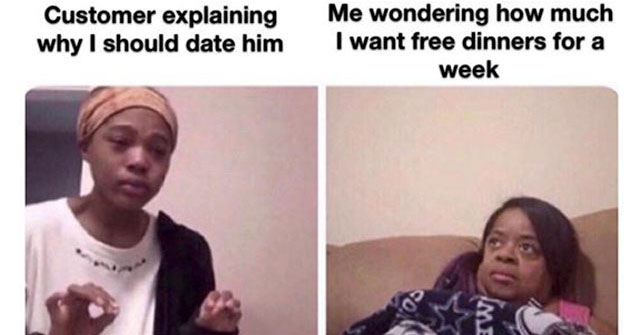
At what (x,y) coordinates should I click in order to perform the action: click on blanket. Please return your answer as a coordinate pair (x, y). Looking at the image, I should click on (461, 320).